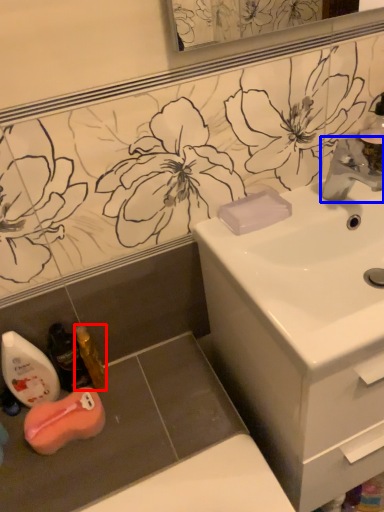
Question: Which point is further to the camera, mouthwash (highlighted by a red box) or tap (highlighted by a blue box)?

Choices:
 (A) mouthwash
 (B) tap

Answer: (A)